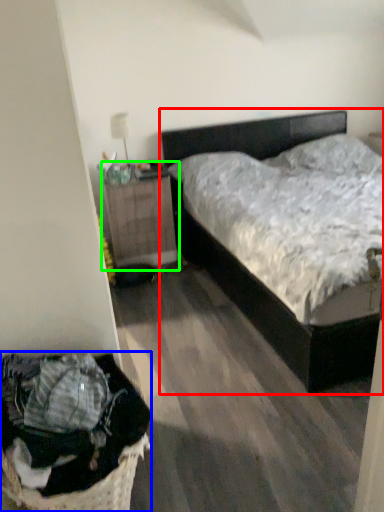
Question: Based on their relative distances, which object is farther from bed (highlighted by a red box)? Choose from laundry basket (highlighted by a blue box) and nightstand (highlighted by a green box).

Choices:
 (A) laundry basket
 (B) nightstand

Answer: (A)